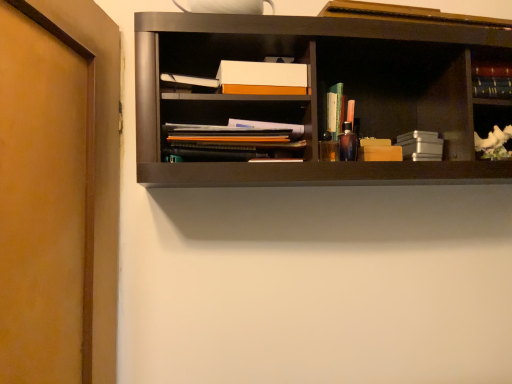
Question: Is metallic silver book at center-right, acting as the second book starting from the right, oriented towards brown matte door at left?

Choices:
 (A) no
 (B) yes

Answer: (A)

Question: Can you confirm if metallic silver book at center-right, acting as the second book starting from the right, is positioned to the right of brown matte door at left?

Choices:
 (A) yes
 (B) no

Answer: (A)

Question: Can you confirm if metallic silver book at center-right, the third book positioned from the left, is shorter than brown matte door at left?

Choices:
 (A) yes
 (B) no

Answer: (A)

Question: Is metallic silver book at center-right, acting as the second book starting from the right, to the left of brown matte door at left from the viewer's perspective?

Choices:
 (A) no
 (B) yes

Answer: (A)

Question: Does metallic silver book at center-right, the third book positioned from the left, have a greater width compared to brown matte door at left?

Choices:
 (A) yes
 (B) no

Answer: (B)

Question: Is metallic silver book at center-right, the third book positioned from the left, oriented away from brown matte door at left?

Choices:
 (A) no
 (B) yes

Answer: (A)

Question: Are translucent plastic pen holder at center, which appears as the 3th book when viewed from the right, and hardcover book at upper right, which appears as the fourth book when viewed from the left, making contact?

Choices:
 (A) no
 (B) yes

Answer: (A)

Question: Does translucent plastic pen holder at center, which appears as the 3th book when viewed from the right, appear on the right side of hardcover book at upper right, which appears as the fourth book when viewed from the left?

Choices:
 (A) yes
 (B) no

Answer: (B)

Question: Could hardcover book at upper right, which appears as the first book when viewed from the right, be considered to be inside translucent plastic pen holder at center, which appears as the 3th book when viewed from the right?

Choices:
 (A) yes
 (B) no

Answer: (B)

Question: From a real-world perspective, is translucent plastic pen holder at center, the second book positioned from the left, physically below hardcover book at upper right, which appears as the first book when viewed from the right?

Choices:
 (A) yes
 (B) no

Answer: (A)

Question: Is translucent plastic pen holder at center, the second book positioned from the left, wider than hardcover book at upper right, which appears as the fourth book when viewed from the left?

Choices:
 (A) no
 (B) yes

Answer: (A)

Question: From the image's perspective, is translucent plastic pen holder at center, which appears as the 3th book when viewed from the right, under hardcover book at upper right, which appears as the fourth book when viewed from the left?

Choices:
 (A) no
 (B) yes

Answer: (B)

Question: Does hardcover book at upper right, which appears as the first book when viewed from the right, have a lesser height compared to white porcelain vase at right?

Choices:
 (A) yes
 (B) no

Answer: (A)